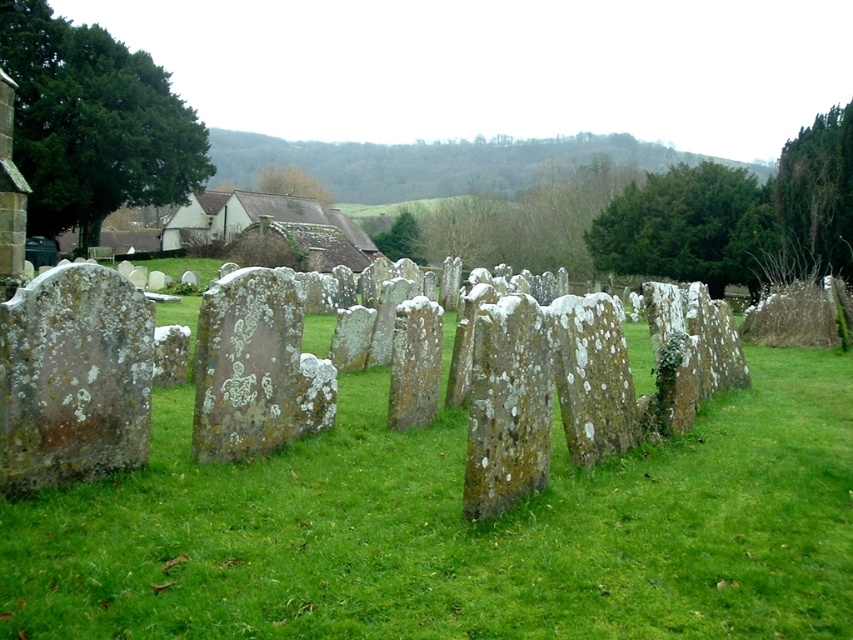
Based on the photo, you are a groundskeeper tasked with maintaining the cemetery. You notice a speckled stone at left and a speckled mossy tombstone at center. Which object is closer to the ground?

The speckled stone at left is positioned over the speckled mossy tombstone at center, so the tombstone is closer to the ground.

You are standing at the entrance of the cemetery and see two points marked in the image. Which point, point (x=577, y=396) or point (x=405, y=337), is closer to you?

Point (x=577, y=396) is closer to the camera than point (x=405, y=337), so it is closer to you.

You are visiting the cemetery and notice two speckled stones. The speckled stone at left and the speckled stone at center. Which one is taller?

The speckled stone at left is taller than the speckled stone at center.